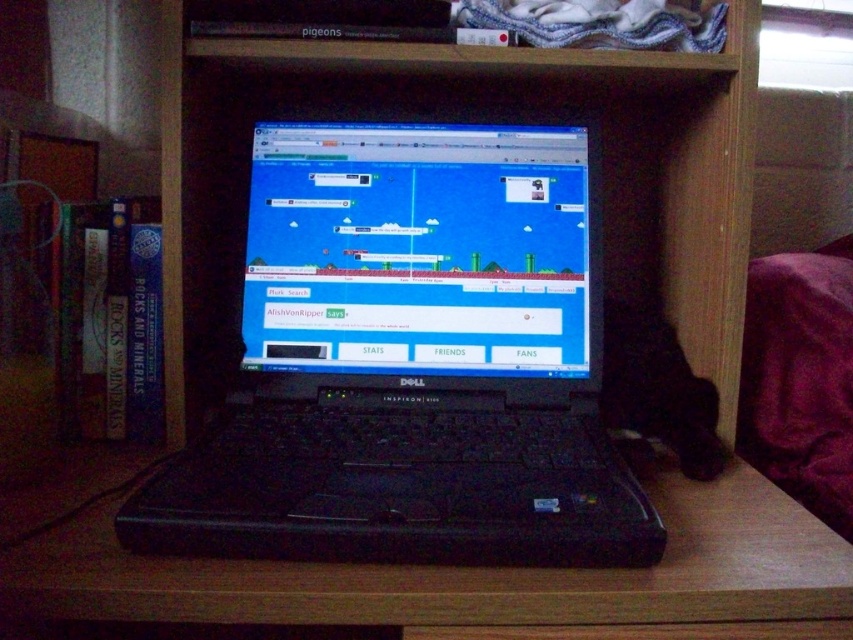
Which is above, black plastic laptop at center or black plastic table at center?

black plastic laptop at center is above.

Who is positioned more to the right, black plastic laptop at center or black plastic table at center?

black plastic laptop at center is more to the right.

Does point (563, 326) lie in front of point (463, 600)?

No.

Find the location of a particular element. The image size is (853, 640). black plastic laptop at center is located at coordinates (410, 360).